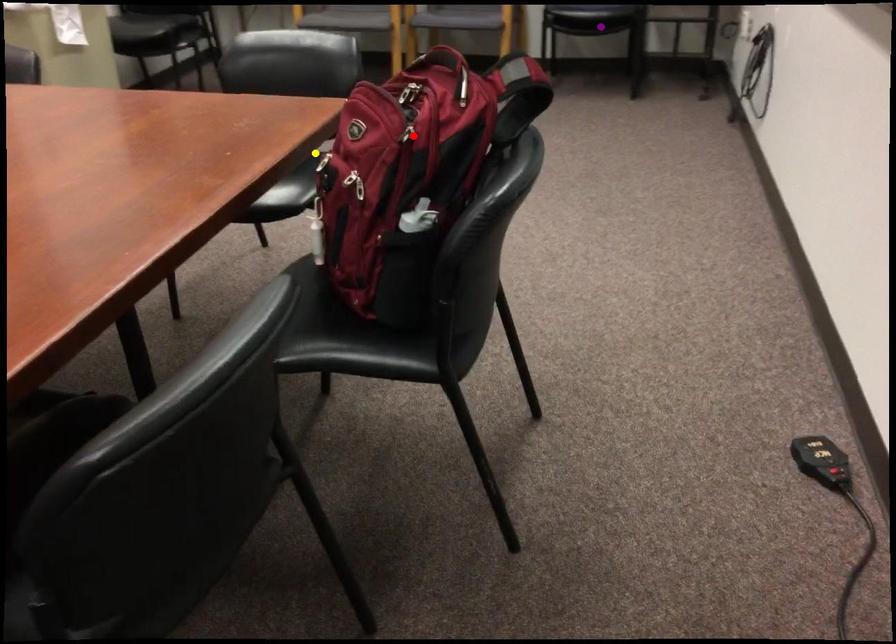
Order these from nearest to farthest:
red point
yellow point
purple point

red point < yellow point < purple point